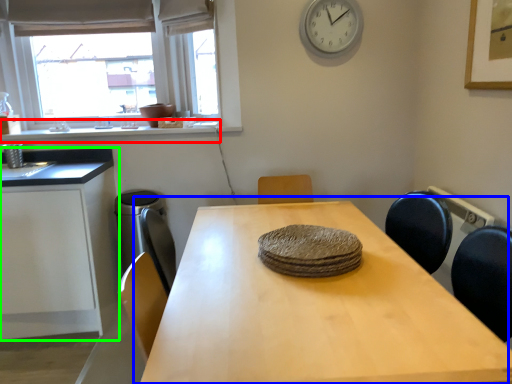
Question: Which is nearer to the window sill (highlighted by a red box)? table (highlighted by a blue box) or cabinetry (highlighted by a green box).

Choices:
 (A) table
 (B) cabinetry

Answer: (B)